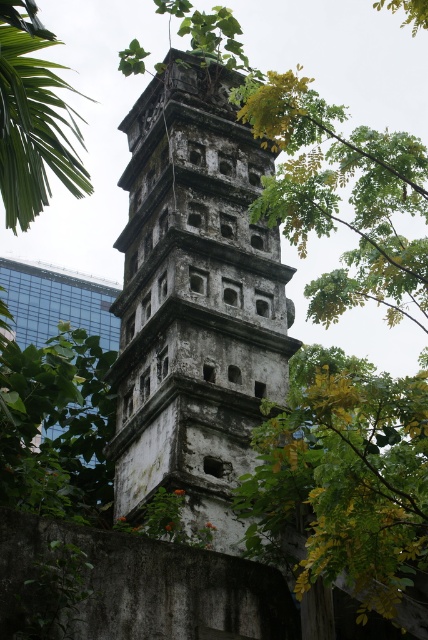
Can you confirm if weathered stone tower at center is smaller than green leafy tree at center?

No, weathered stone tower at center is not smaller than green leafy tree at center.

Does weathered stone tower at center appear over green leafy tree at center?

Yes.

Image resolution: width=428 pixels, height=640 pixels. In order to click on weathered stone tower at center in this screenshot , I will do `click(195, 300)`.

Is the position of weathered stone tower at center more distant than that of green leafy tree at left?

Yes, weathered stone tower at center is behind green leafy tree at left.

Between point (228, 552) and point (67, 83), which one is positioned in front?

Point (228, 552) is more forward.

You are a GUI agent. You are given a task and a screenshot of the screen. Output one action in this format:
    pyautogui.click(x=<x>, y=<y>)
    Task: Click on the weathered stone tower at center
    
    Given the screenshot: What is the action you would take?
    (195, 300)

Which of these two, green leafy tree at center or green leafy tree at left, stands shorter?

With less height is green leafy tree at center.

Who is lower down, green leafy tree at center or green leafy tree at left?

green leafy tree at center is lower down.

Does point (338, 481) come in front of point (2, 195)?

Yes, point (338, 481) is in front of point (2, 195).

What are the coordinates of `green leafy tree at center` in the screenshot? It's located at (344, 476).